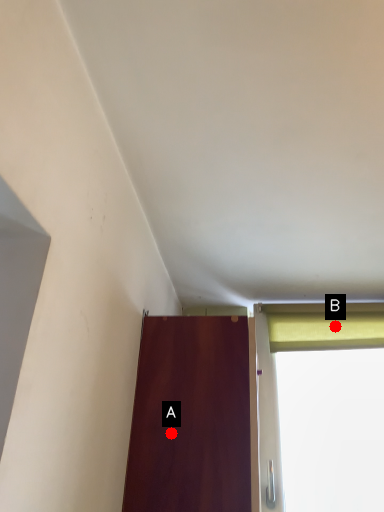
Question: Two points are circled on the image, labeled by A and B beside each circle. Which point appears closest to the camera in this image?

Choices:
 (A) A is closer
 (B) B is closer

Answer: (A)